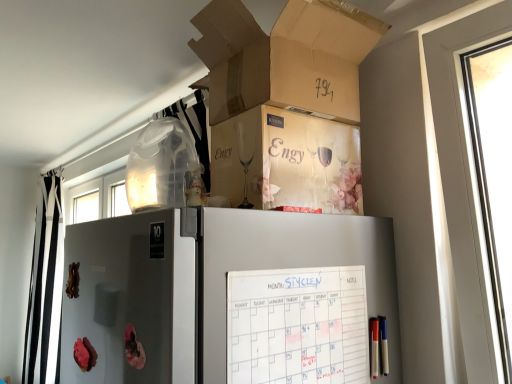
Question: In the image, is metallic silver screen door at lower left positioned in front of or behind white paper calendar at upper center?

Choices:
 (A) behind
 (B) front

Answer: (B)

Question: Looking at the image, does metallic silver screen door at lower left seem bigger or smaller compared to white paper calendar at upper center?

Choices:
 (A) small
 (B) big

Answer: (B)

Question: Considering the real-world distances, which object is closest to the metallic silver screen door at lower left?

Choices:
 (A) black/white striped curtain at left
 (B) white paper calendar at upper center
 (C) cardboard box at upper center
 (D) beige cardboard box at upper center

Answer: (B)

Question: Which object is the closest to the cardboard box at upper center?

Choices:
 (A) metallic silver screen door at lower left
 (B) white paper calendar at upper center
 (C) black/white striped curtain at left
 (D) beige cardboard box at upper center

Answer: (D)